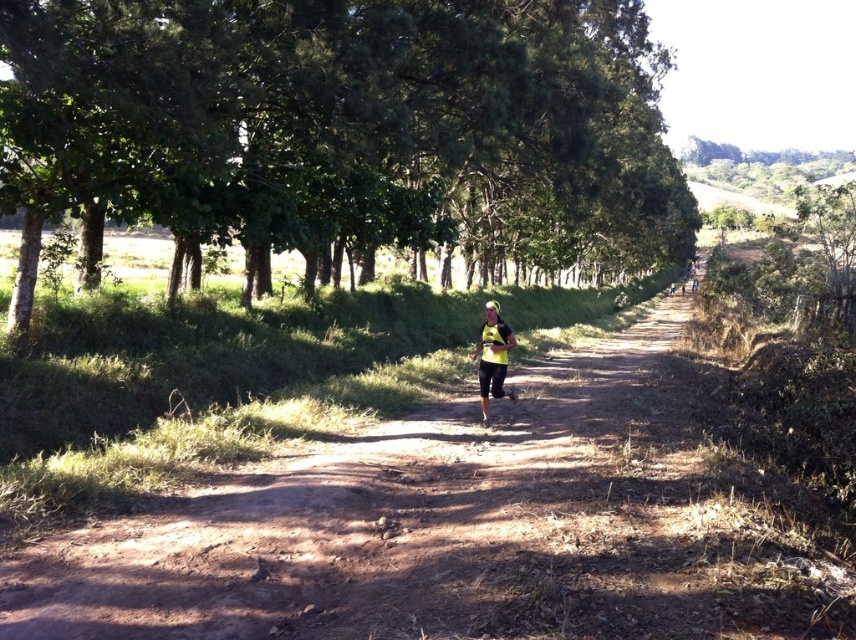
Based on the scene, if the green leafy trees at center and the yellow matte running outfit at center are both positioned along the dirt path, which object occupies more horizontal space from the observer perspective?

The green leafy trees at center have a greater width than the yellow matte running outfit at center, so they occupy more horizontal space from the observer perspective.

You are a photographer aiming to capture the runner in the yellow matte running outfit at center without any obstruction from the green leafy trees at center. Based on the scene, can you position yourself in a way to achieve this?

The green leafy trees at center are positioned over the yellow matte running outfit at center, so if you position yourself below the runner, you can capture them without obstruction from the trees.

You are a drone operator trying to capture a photo of the runner. The drone is currently hovering at point 0.3, 0.4. The green leafy trees at center are at point 0.191, 0.419. To avoid the trees, should you move the drone north or south?

The green leafy trees at center are located at point (358, 122). The drone is at (342, 192). Since the trees are slightly to the south of the drone, moving north would take the drone away from the trees. Therefore, to avoid the trees, you should move the drone north.